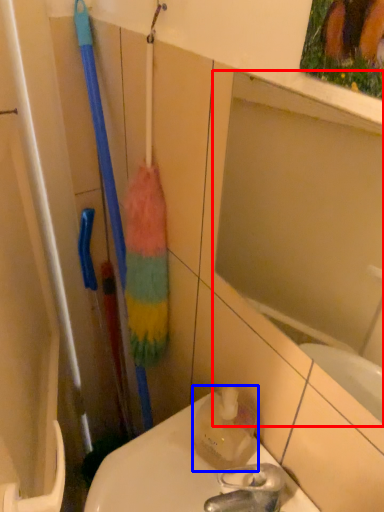
Question: Which of the following is the farthest to the observer, mirror (highlighted by a red box) or cleaning product (highlighted by a blue box)?

Choices:
 (A) mirror
 (B) cleaning product

Answer: (B)